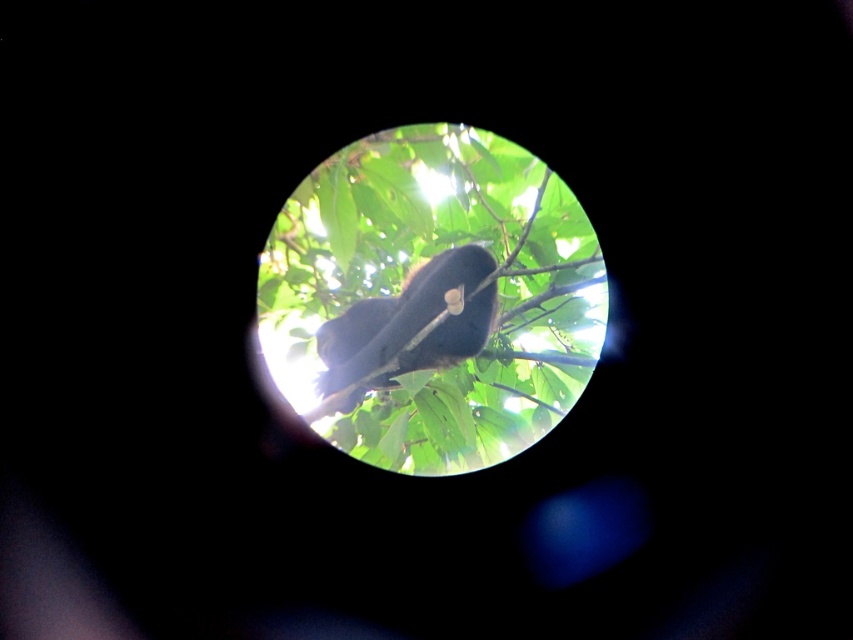
Between point (515, 380) and point (329, 355), which one is positioned behind?

The point (515, 380) is behind.

Between green leafy tree at center and shiny black monkey at center, which one is positioned lower?

Positioned lower is shiny black monkey at center.

Is point (310, 301) positioned behind point (387, 349)?

No, (310, 301) is in front of (387, 349).

The height and width of the screenshot is (640, 853). Identify the location of green leafy tree at center. (432, 298).